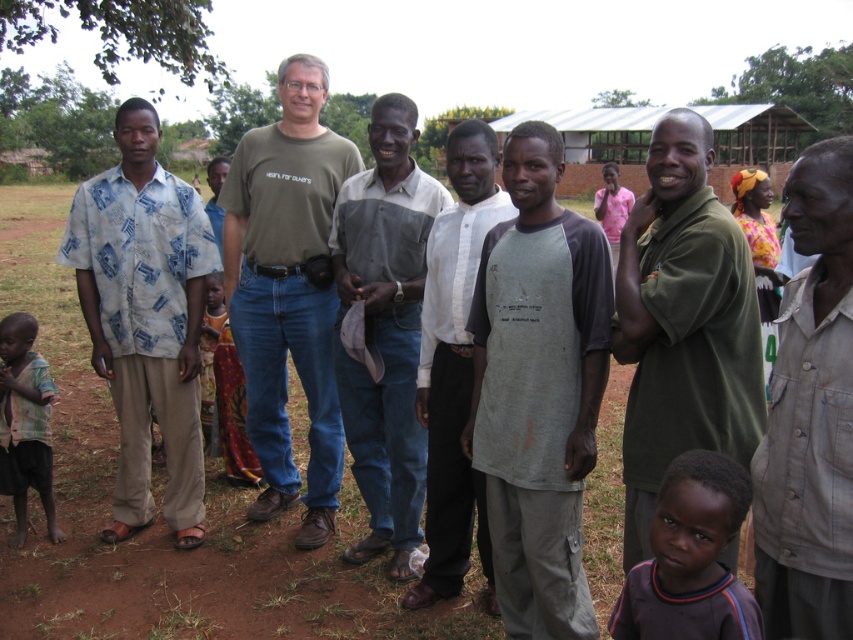
How distant is matte green t-shirt at center from gray fabric shirt at center?

matte green t-shirt at center is 1.25 meters from gray fabric shirt at center.

Does matte green t-shirt at center come behind gray fabric shirt at center?

Yes, matte green t-shirt at center is further from the viewer.

Identify the location of matte green t-shirt at center. The width and height of the screenshot is (853, 640). (288, 291).

The width and height of the screenshot is (853, 640). I want to click on matte green t-shirt at center, so click(288, 291).

Does gray fabric shirt at center appear on the right side of dark gray shirt at lower right?

Incorrect, gray fabric shirt at center is not on the right side of dark gray shirt at lower right.

Can you confirm if gray fabric shirt at center is positioned to the left of dark gray shirt at lower right?

Indeed, gray fabric shirt at center is positioned on the left side of dark gray shirt at lower right.

Which is in front, point (360, 252) or point (730, 536)?

Point (730, 536)

The image size is (853, 640). I want to click on gray fabric shirt at center, so click(x=386, y=326).

Between gray cotton shirt at center and printed fabric dress at center, which one appears on the left side from the viewer's perspective?

From the viewer's perspective, printed fabric dress at center appears more on the left side.

Is gray cotton shirt at center closer to the viewer compared to printed fabric dress at center?

Yes.

Locate an element on the screen. Image resolution: width=853 pixels, height=640 pixels. gray cotton shirt at center is located at coordinates (538, 388).

This screenshot has width=853, height=640. Identify the location of gray cotton shirt at center. (538, 388).